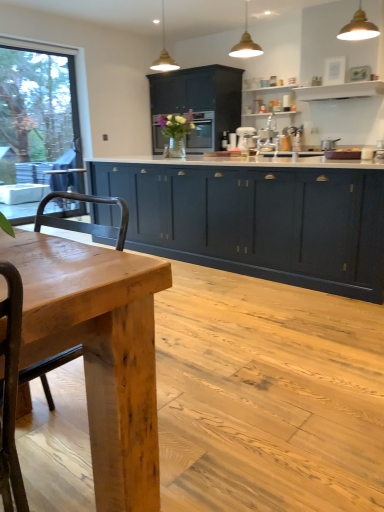
Question: Is matte black oven at center bigger than matte dark blue cabinets at center, the 1th cabinetry from the front?

Choices:
 (A) yes
 (B) no

Answer: (B)

Question: From the image's perspective, is matte black oven at center over matte dark blue cabinets at center, which appears as the second cabinetry when viewed from the top?

Choices:
 (A) yes
 (B) no

Answer: (A)

Question: Is matte black oven at center directly adjacent to matte dark blue cabinets at center, the second cabinetry in the back-to-front sequence?

Choices:
 (A) no
 (B) yes

Answer: (A)

Question: Is matte black oven at center facing towards matte dark blue cabinets at center, the 1th cabinetry from the front?

Choices:
 (A) no
 (B) yes

Answer: (A)

Question: Is matte black oven at center closer to camera compared to matte dark blue cabinets at center, the second cabinetry in the back-to-front sequence?

Choices:
 (A) no
 (B) yes

Answer: (A)

Question: Considering the relative sizes of matte black oven at center and matte dark blue cabinets at center, which appears as the second cabinetry when viewed from the top, in the image provided, is matte black oven at center wider than matte dark blue cabinets at center, which appears as the second cabinetry when viewed from the top,?

Choices:
 (A) yes
 (B) no

Answer: (B)

Question: From a real-world perspective, is matte dark blue cabinets at center, which appears as the second cabinetry when viewed from the top, physically above matte gold pendant light at upper center, the second light fixture positioned from the front?

Choices:
 (A) no
 (B) yes

Answer: (A)

Question: Considering the relative sizes of matte dark blue cabinets at center, the first cabinetry when ordered from bottom to top, and matte gold pendant light at upper center, which is the second light fixture from left to right, in the image provided, is matte dark blue cabinets at center, the first cabinetry when ordered from bottom to top, taller than matte gold pendant light at upper center, which is the second light fixture from left to right,?

Choices:
 (A) no
 (B) yes

Answer: (B)

Question: Is matte dark blue cabinets at center, the 1th cabinetry from the front, closer to the viewer compared to matte gold pendant light at upper center, the second light fixture positioned from the front?

Choices:
 (A) yes
 (B) no

Answer: (A)

Question: Can you confirm if matte dark blue cabinets at center, the 1th cabinetry from the front, is positioned to the left of matte gold pendant light at upper center, which is the second light fixture from left to right?

Choices:
 (A) yes
 (B) no

Answer: (B)

Question: From the image's perspective, is matte dark blue cabinets at center, the first cabinetry when ordered from bottom to top, located above matte gold pendant light at upper center, the second light fixture positioned from the front?

Choices:
 (A) yes
 (B) no

Answer: (B)

Question: From the image's perspective, would you say matte dark blue cabinets at center, the second cabinetry in the back-to-front sequence, is shown under matte gold pendant light at upper center, the second light fixture from the back?

Choices:
 (A) no
 (B) yes

Answer: (B)

Question: Is the depth of metallic gold pendant light at upper center, the 1th light fixture positioned from the right, greater than that of transparent glass window at left?

Choices:
 (A) no
 (B) yes

Answer: (A)